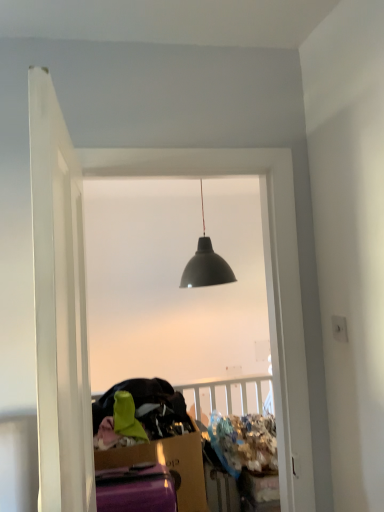
Question: Is white smooth door at left behind matte black lampshade at center?

Choices:
 (A) yes
 (B) no

Answer: (B)

Question: Is white smooth door at left smaller than matte black lampshade at center?

Choices:
 (A) no
 (B) yes

Answer: (A)

Question: Considering the relative sizes of white smooth door at left and matte black lampshade at center in the image provided, is white smooth door at left bigger than matte black lampshade at center?

Choices:
 (A) no
 (B) yes

Answer: (B)

Question: Considering the relative sizes of white smooth door at left and matte black lampshade at center in the image provided, is white smooth door at left taller than matte black lampshade at center?

Choices:
 (A) no
 (B) yes

Answer: (A)

Question: From the image's perspective, is white smooth door at left beneath matte black lampshade at center?

Choices:
 (A) yes
 (B) no

Answer: (B)

Question: Is white smooth door at left wider than matte black lampshade at center?

Choices:
 (A) no
 (B) yes

Answer: (B)

Question: Would you say white smooth door at left is part of matte black lampshade at center's contents?

Choices:
 (A) no
 (B) yes

Answer: (A)

Question: Is matte black lampshade at center shorter than white smooth door at left?

Choices:
 (A) yes
 (B) no

Answer: (B)

Question: From the image's perspective, would you say matte black lampshade at center is positioned over white smooth door at left?

Choices:
 (A) yes
 (B) no

Answer: (B)

Question: Does matte black lampshade at center appear on the right side of white smooth door at left?

Choices:
 (A) no
 (B) yes

Answer: (B)

Question: Would you consider matte black lampshade at center to be distant from white smooth door at left?

Choices:
 (A) yes
 (B) no

Answer: (A)

Question: Is matte black lampshade at center closer to camera compared to white smooth door at left?

Choices:
 (A) yes
 (B) no

Answer: (B)

Question: Would you say matte black lampshade at center is inside or outside white smooth door at left?

Choices:
 (A) inside
 (B) outside

Answer: (B)